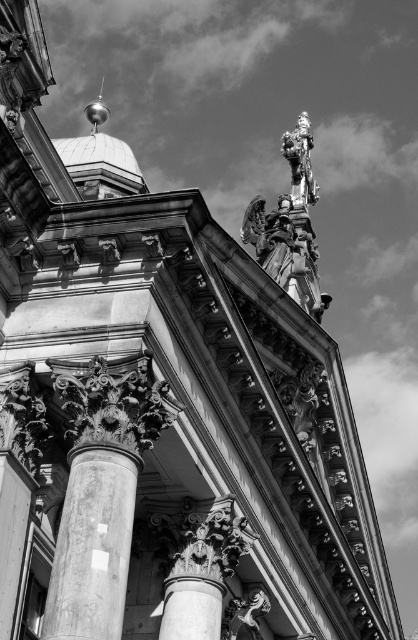
Does point (109, 483) lie behind point (76, 148)?

No, (109, 483) is closer to viewer.

Is marble column at center in front of white glossy dome at center?

Yes, it is.

Is point (79, 620) farther from camera compared to point (86, 136)?

No, (79, 620) is closer to viewer.

At what (x,y) coordinates should I click in order to perform the action: click on marble column at center. Please return your answer as a coordinate pair (x, y). This screenshot has width=418, height=640. Looking at the image, I should click on (92, 545).